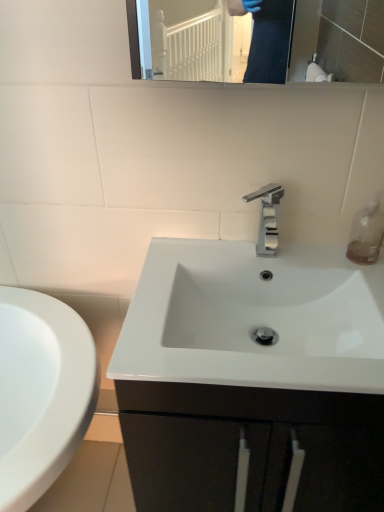
Identify the location of free point to the left of polished chrome faucet at center. (210, 257).